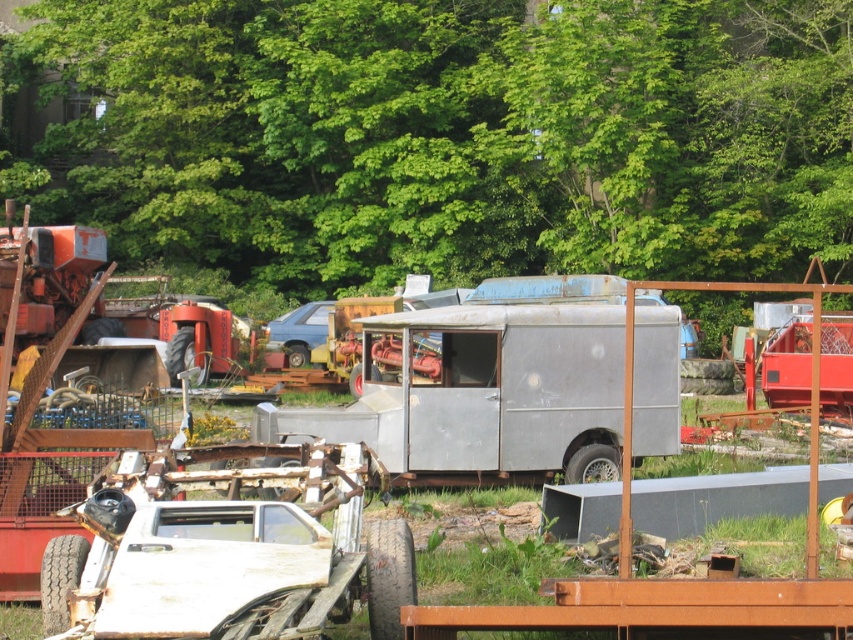
You are standing in the middle of the junkyard and see the point marked at coordinates (451, 134). What object is located at that point?

The point at coordinates (451, 134) indicates a green leafy tree at upper center.

You are standing in a junkyard and need to reach the rusty metal trailer truck at center. If your maximum walking distance is 20 meters, can you reach it without needing to rest?

The distance between you and the rusty metal trailer truck at center is 17.75 meters, which is within your 20 meter limit, so yes, you can reach it without needing to rest.

You are navigating a drone over a junkyard and need to drop off a package at the rusty metal trailer truck at center. According to the coordinates provided, where should you direct the drone to land?

The rusty metal trailer truck at center is located at point (480, 394), so you should direct the drone to land there.